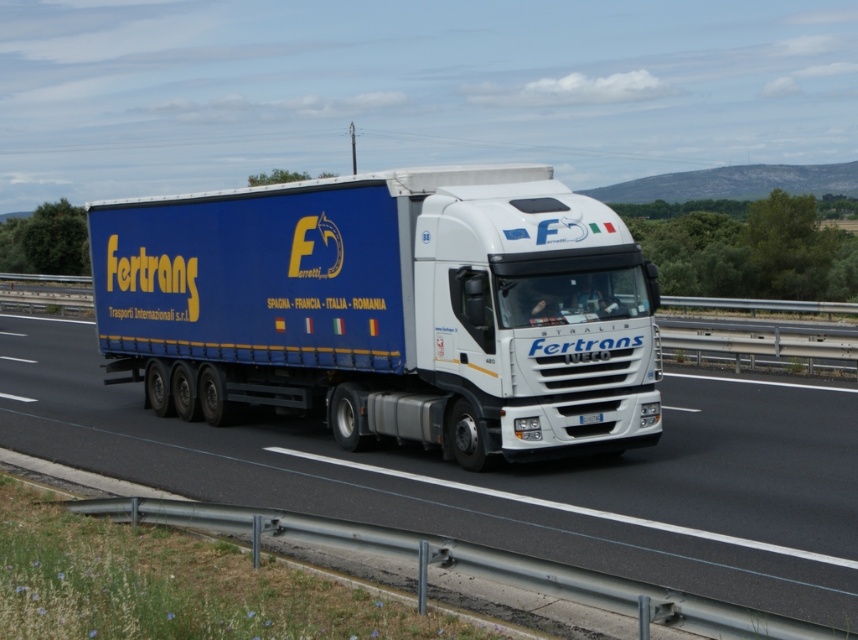
Question: Is blue matte trailer truck at center below white glossy truck at center?

Choices:
 (A) yes
 (B) no

Answer: (B)

Question: Which point is farther from the camera taking this photo?

Choices:
 (A) (769, 388)
 (B) (284, 406)

Answer: (A)

Question: Does blue matte trailer truck at center have a smaller size compared to white glossy truck at center?

Choices:
 (A) yes
 (B) no

Answer: (B)

Question: Can you confirm if blue matte trailer truck at center is thinner than white glossy truck at center?

Choices:
 (A) yes
 (B) no

Answer: (A)